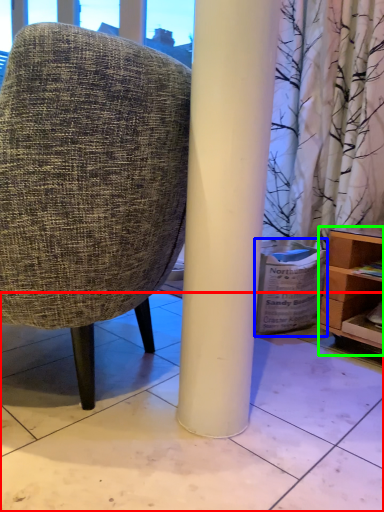
Question: Estimate the real-world distances between objects in this image. Which object is farther from tile (highlighted by a red box), cardboard box (highlighted by a blue box) or shelf (highlighted by a green box)?

Choices:
 (A) cardboard box
 (B) shelf

Answer: (B)